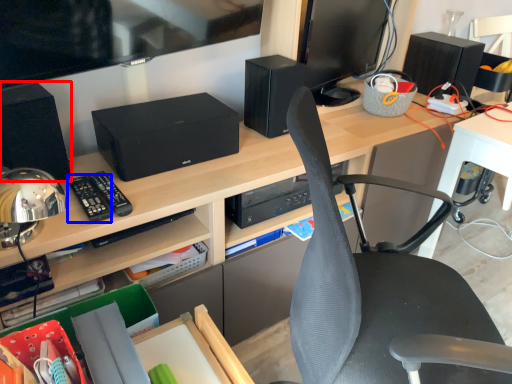
Question: Which object appears closest to the camera in this image, speaker (highlighted by a red box) or control (highlighted by a blue box)?

Choices:
 (A) speaker
 (B) control

Answer: (A)